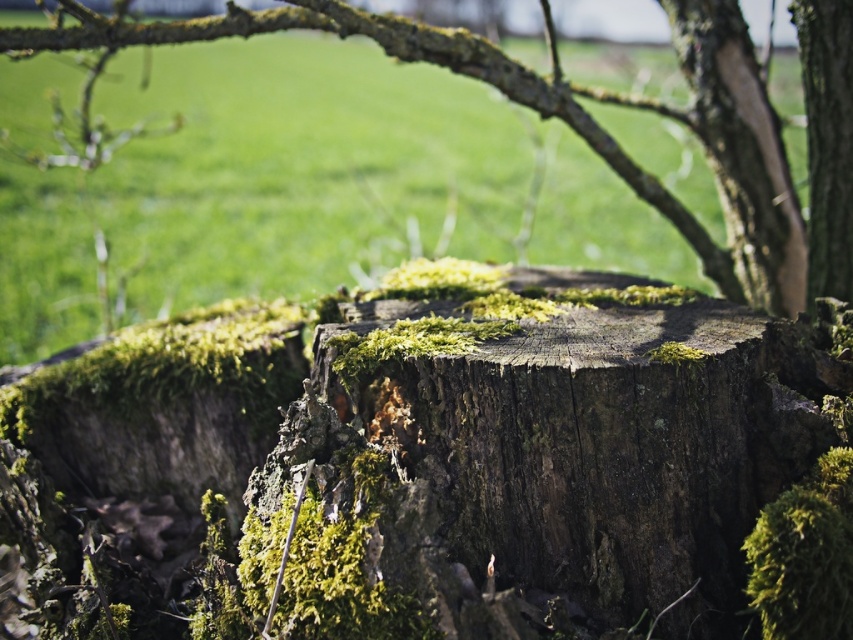
Is green mossy wood at center shorter than smooth bark tree trunk at upper right?

Correct, green mossy wood at center is not as tall as smooth bark tree trunk at upper right.

Between green mossy wood at center and smooth bark tree trunk at upper right, which one has less height?

Standing shorter between the two is green mossy wood at center.

Is point (695, 40) positioned behind point (750, 45)?

That is True.

Locate an element on the screen. This screenshot has height=640, width=853. green mossy wood at center is located at coordinates (630, 106).

Who is more distant from viewer, (733, 33) or (807, 33)?

Point (733, 33)

Is green mossy wood at center thinner than smooth bark tree trunk at right?

Incorrect, green mossy wood at center's width is not less than smooth bark tree trunk at right's.

At what (x,y) coordinates should I click in order to perform the action: click on green mossy wood at center. Please return your answer as a coordinate pair (x, y). Looking at the image, I should click on (630, 106).

Where is `green mossy wood at center`? This screenshot has height=640, width=853. green mossy wood at center is located at coordinates (630, 106).

Does smooth bark tree trunk at upper right come in front of smooth bark tree trunk at right?

No, smooth bark tree trunk at upper right is further to the viewer.

Does smooth bark tree trunk at upper right appear over smooth bark tree trunk at right?

Correct, smooth bark tree trunk at upper right is located above smooth bark tree trunk at right.

Identify the location of smooth bark tree trunk at upper right. The width and height of the screenshot is (853, 640). (741, 150).